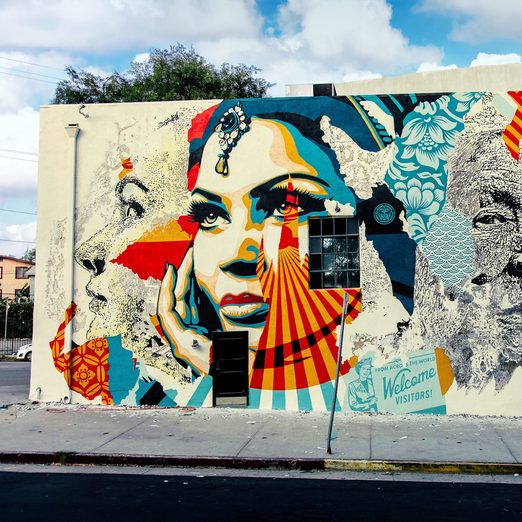
Image resolution: width=522 pixels, height=522 pixels. In order to click on "welcome visitors" painting in this screenshot , I will do `click(409, 383)`.